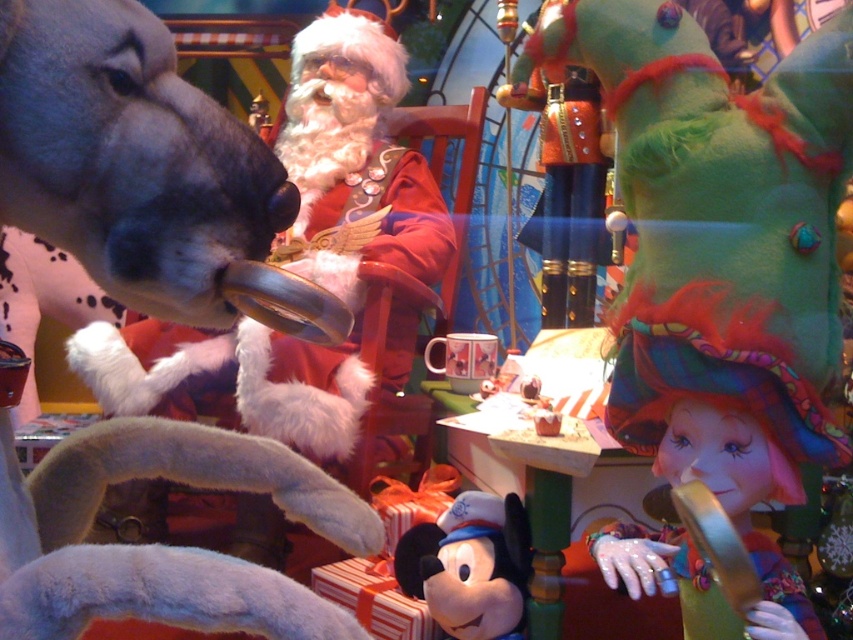
You are organizing a holiday party and need to decide which item to place on the main table. The multicolored tulle hat at lower right and the soft plush mickey mouse at center are both candidates. Based on their sizes, which one would be more suitable for a centerpiece?

The multicolored tulle hat at lower right has a larger size compared to the soft plush mickey mouse at center, making it more suitable as a centerpiece for the main table.

You are standing at the position of Santa Claus in the scene. There are two points marked in the image. The first point is at coordinates point (751, 141) and the second point is at point (480, 582). Which of these two points is closer to you?

Point (751, 141) is in front of point (480, 582), so the first point is closer to Santa Claus.

Consider the image. You are standing in front of a holiday display featuring a fuzzy red santa at center. If you want to give him a hug, will you be able to reach him without moving your feet?

The fuzzy red santa at center is 2.01 meters away from the viewer, so you can reach him without moving your feet since the distance is just over 2 meters, which is within a typical reaching distance.